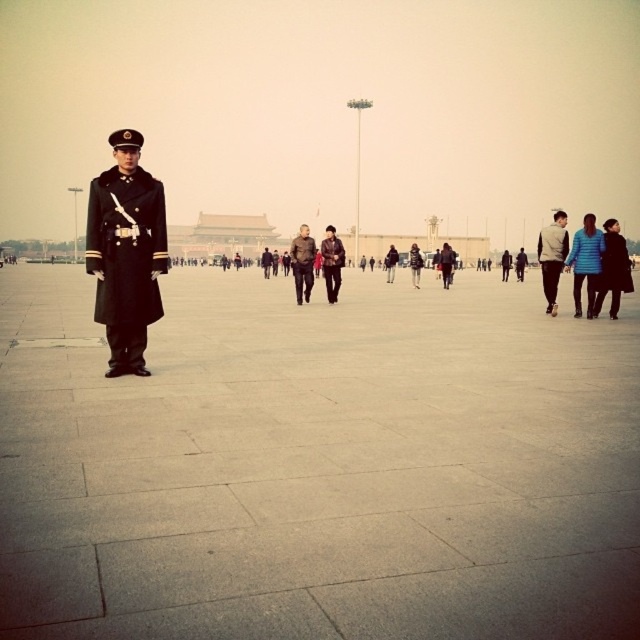
Question: Which point is farther to the camera?

Choices:
 (A) (324, 260)
 (B) (152, 260)
 (C) (554, 252)

Answer: (A)

Question: Considering the relative positions of black woolen coat at center and light gray fabric jacket at right in the image provided, where is black woolen coat at center located with respect to light gray fabric jacket at right?

Choices:
 (A) below
 (B) above

Answer: (A)

Question: Among these objects, which one is nearest to the camera?

Choices:
 (A) dark brown leather jacket at center
 (B) brown leather jacket at center
 (C) light gray fabric jacket at right
 (D) black woolen coat at center

Answer: (D)

Question: Is matte black uniform at right to the left of brown leather jacket at center from the viewer's perspective?

Choices:
 (A) no
 (B) yes

Answer: (A)

Question: Which of the following is the farthest from the observer?

Choices:
 (A) matte black uniform at right
 (B) dark brown leather jacket at center

Answer: (B)

Question: Considering the relative positions of matte black uniform at right and brown leather jacket at center in the image provided, where is matte black uniform at right located with respect to brown leather jacket at center?

Choices:
 (A) below
 (B) above

Answer: (A)